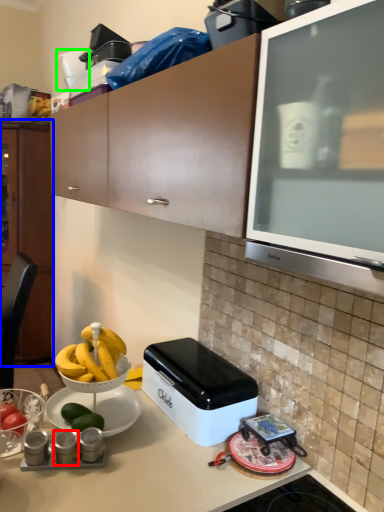
Question: Considering the real-world distances, which object is farthest from appliance (highlighted by a red box)? cabinetry (highlighted by a blue box) or appliance (highlighted by a green box)?

Choices:
 (A) cabinetry
 (B) appliance

Answer: (A)